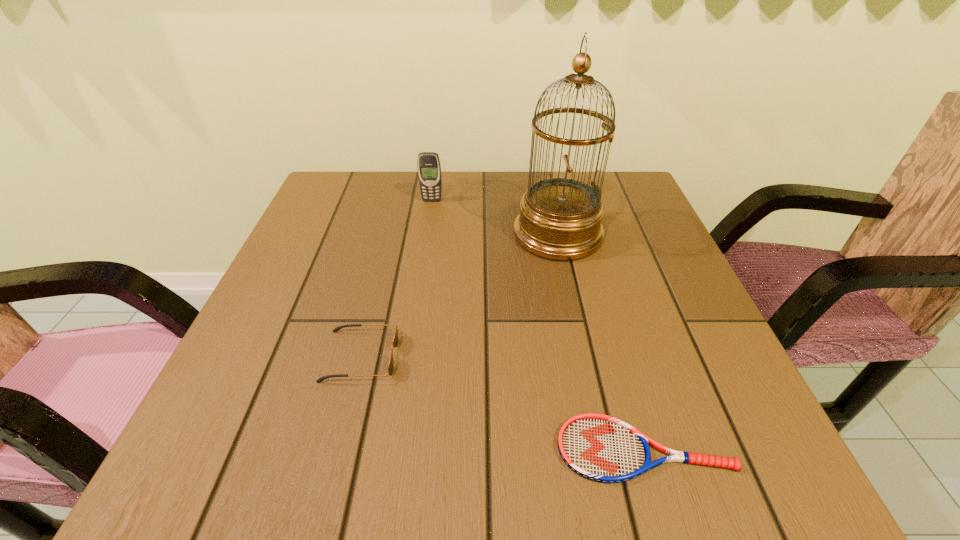
Find the location of a particular element. object that stands as the third closest to the nearest object is located at coordinates (429, 168).

The image size is (960, 540). What are the coordinates of `vacant area that satisfies the following two spatial constraints: 1. with an open door on the tennis racket; 2. on the left side of the second farthest object` in the screenshot? It's located at (605, 449).

Where is `free spot that satisfies the following two spatial constraints: 1. on the screen of the tennis racket; 2. on the left side of the cellular telephone`? free spot that satisfies the following two spatial constraints: 1. on the screen of the tennis racket; 2. on the left side of the cellular telephone is located at coordinates (395, 449).

I want to click on vacant space that satisfies the following two spatial constraints: 1. on the screen of the second tallest object; 2. on the front-facing side of the sunglasses, so coord(409,356).

Find the location of a particular element. This screenshot has height=540, width=960. free location that satisfies the following two spatial constraints: 1. on the front-facing side of the second nearest object; 2. on the left side of the shortest object is located at coordinates (338, 449).

At what (x,y) coordinates should I click in order to perform the action: click on free space that satisfies the following two spatial constraints: 1. on the front-facing side of the third tallest object; 2. on the right side of the tennis racket. Please return your answer as a coordinate pair (x, y). This screenshot has height=540, width=960. Looking at the image, I should click on (338, 449).

Image resolution: width=960 pixels, height=540 pixels. In order to click on vacant position in the image that satisfies the following two spatial constraints: 1. on the front-facing side of the second shortest object; 2. on the left side of the shortest object in this screenshot , I will do (x=338, y=449).

Locate an element on the screen. The image size is (960, 540). free location that satisfies the following two spatial constraints: 1. with an open door on the birdcage; 2. on the left side of the nearest object is located at coordinates (605, 449).

Image resolution: width=960 pixels, height=540 pixels. I want to click on free spot that satisfies the following two spatial constraints: 1. on the front-facing side of the third tallest object; 2. on the left side of the nearest object, so click(338, 449).